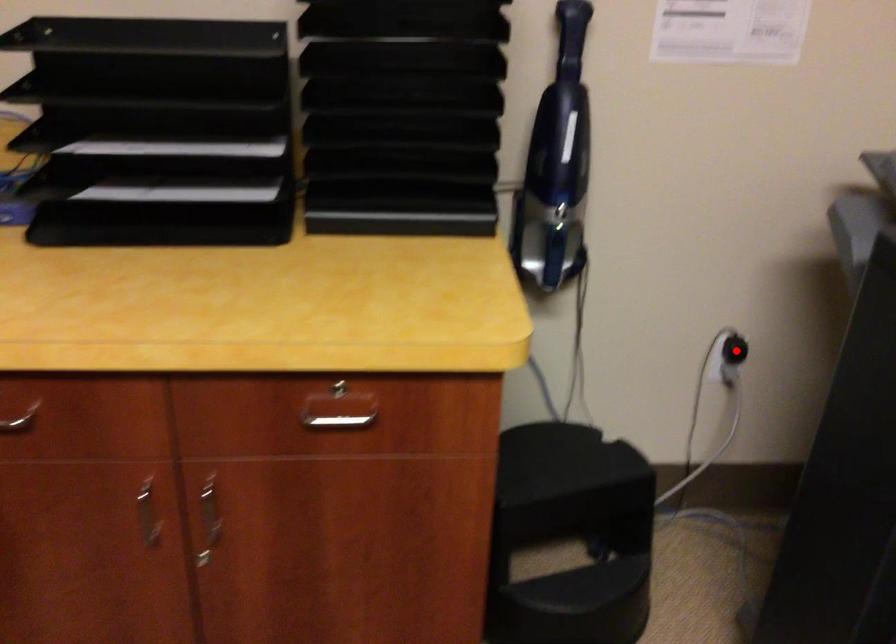
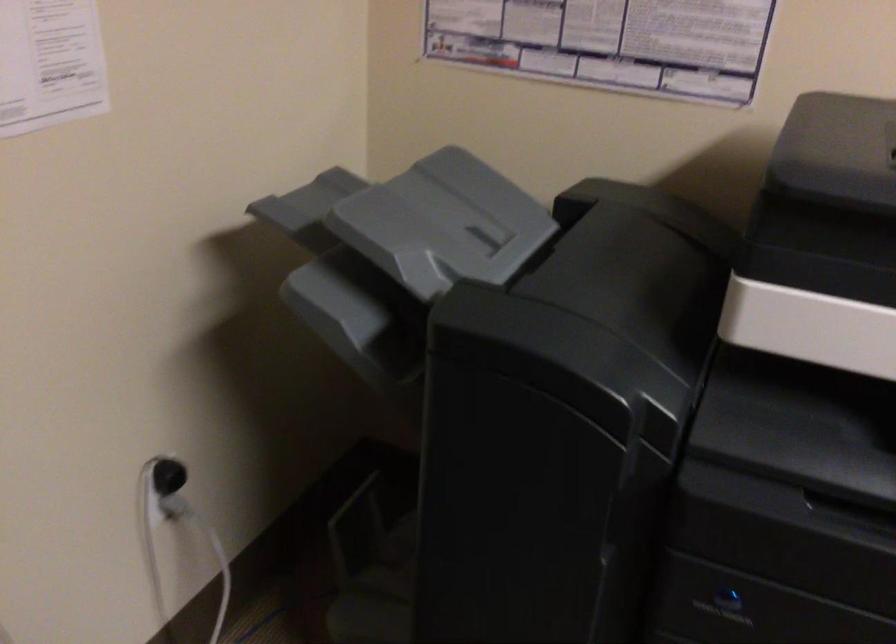
Question: I am providing you with two images of the same scene from different viewpoints. Given a red point in image1, look at the same physical point in image2. Is it:

Choices:
 (A) Closer to the viewpoint
 (B) Farther from the viewpoint

Answer: (A)